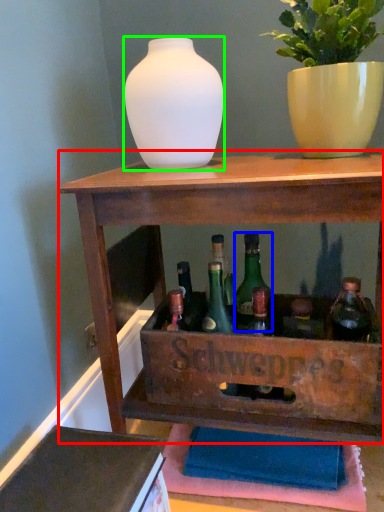
Question: Considering the real-world distances, which object is farthest from shelf (highlighted by a red box)? glass bottle (highlighted by a blue box) or vase (highlighted by a green box)?

Choices:
 (A) glass bottle
 (B) vase

Answer: (B)